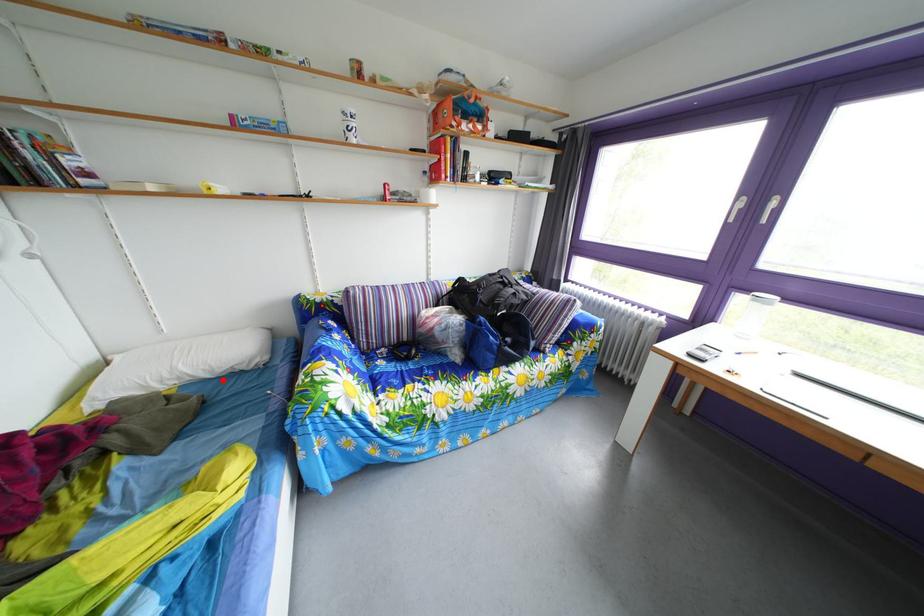
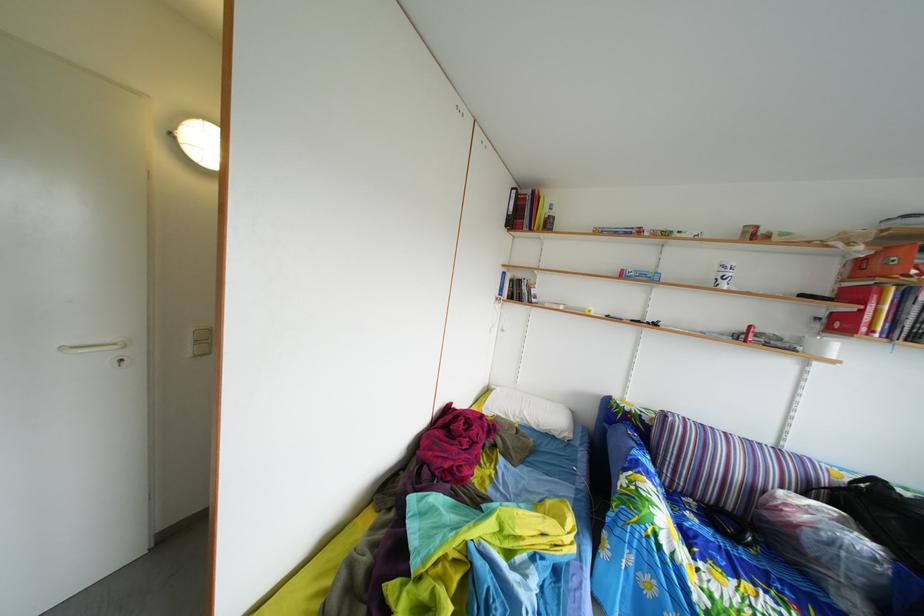
Where in the second image is the point corresponding to the highlighted location from the first image?

(549, 434)